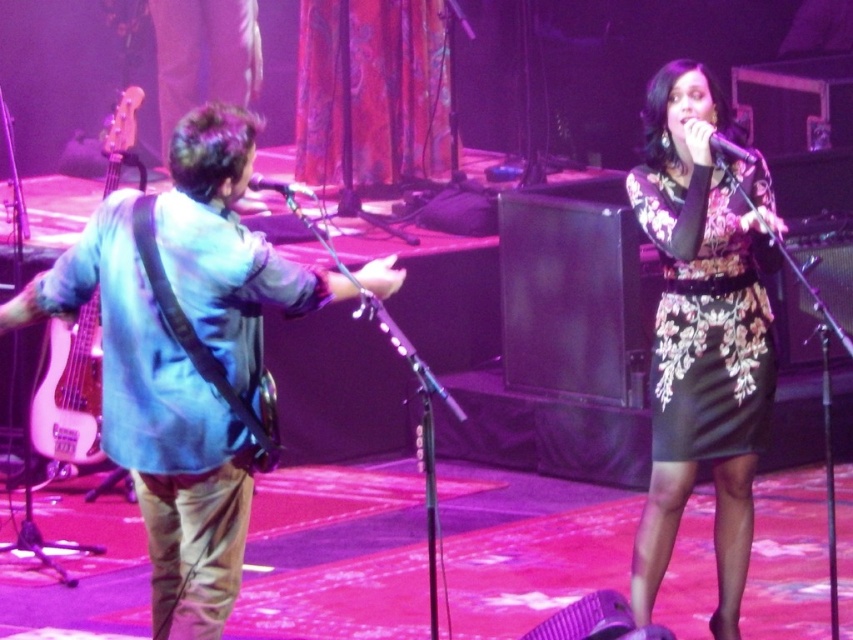
Does blue fabric shirt at left appear on the left side of metallic silver microphone at center?

Indeed, blue fabric shirt at left is positioned on the left side of metallic silver microphone at center.

Who is shorter, blue fabric shirt at left or metallic silver microphone at center?

Standing shorter between the two is metallic silver microphone at center.

At what (x,y) coordinates should I click in order to perform the action: click on blue fabric shirt at left. Please return your answer as a coordinate pair (x, y). This screenshot has width=853, height=640. Looking at the image, I should click on (157, 426).

Does blue fabric shirt at left lie behind black floral dress at center?

No.

Looking at this image, does blue fabric shirt at left appear on the right side of black floral dress at center?

No, blue fabric shirt at left is not to the right of black floral dress at center.

Describe the element at coordinates (157, 426) in the screenshot. I see `blue fabric shirt at left` at that location.

Where is `blue fabric shirt at left`? The image size is (853, 640). blue fabric shirt at left is located at coordinates (157, 426).

How much distance is there between blue fabric shirt at left and black glossy microphone at upper center?

The distance of blue fabric shirt at left from black glossy microphone at upper center is 8.04 feet.

Between blue fabric shirt at left and black glossy microphone at upper center, which one appears on the left side from the viewer's perspective?

blue fabric shirt at left is more to the left.

Between point (229, 259) and point (718, 147), which one is positioned in front?

Point (229, 259)

Where is `blue fabric shirt at left`? blue fabric shirt at left is located at coordinates (157, 426).